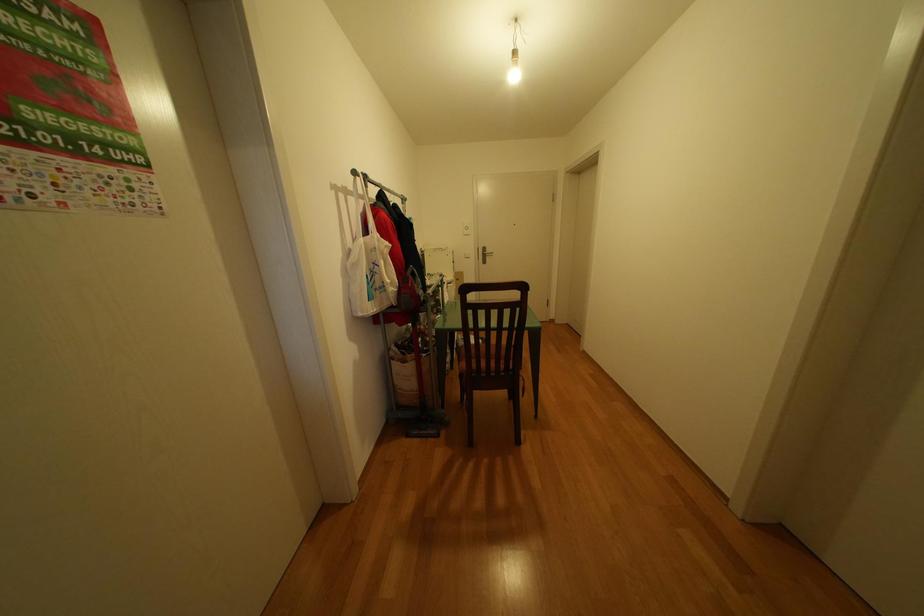
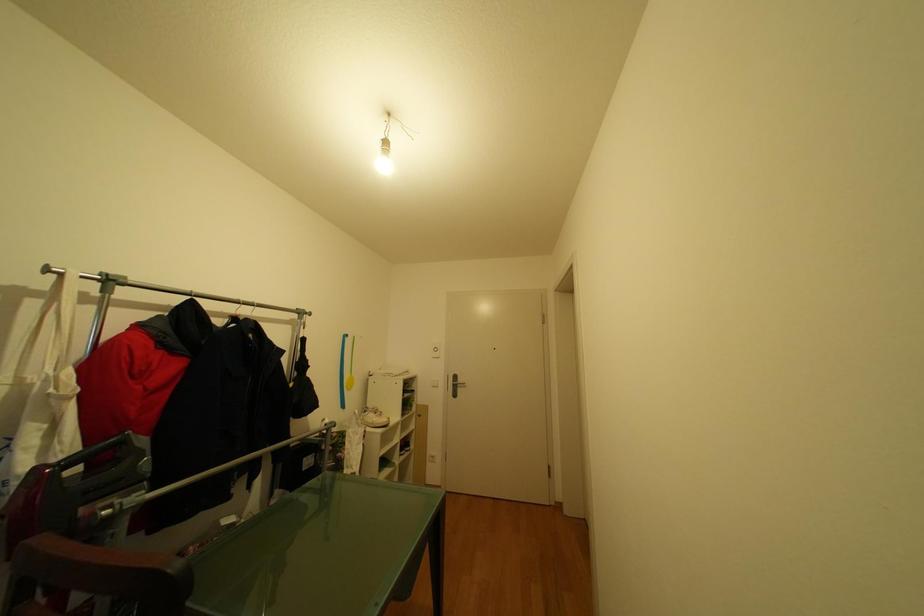
In a continuous first-person perspective shot, in which direction is the camera moving?

The cameraman walked toward right, forward.